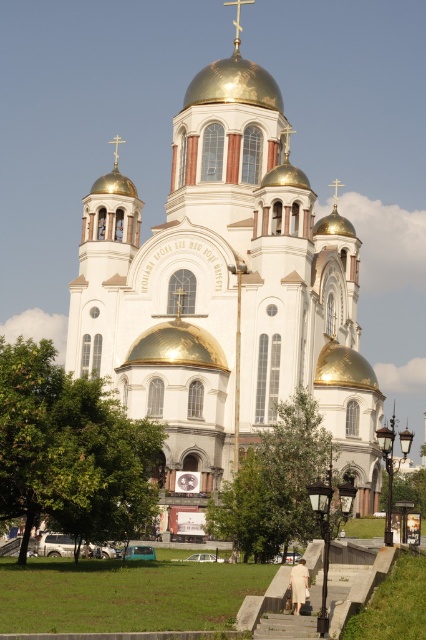
Between point (262, 244) and point (313, 378), which one is positioned in front?

Point (262, 244) is in front.

Describe the element at coordinates (221, 304) in the screenshot. The height and width of the screenshot is (640, 426). I see `white polished stone church at center` at that location.

Describe the element at coordinates (221, 304) in the screenshot. The height and width of the screenshot is (640, 426). I see `white polished stone church at center` at that location.

The height and width of the screenshot is (640, 426). Find the location of `white polished stone church at center`. white polished stone church at center is located at coordinates (221, 304).

Between point (252, 138) and point (229, 100), which one is positioned in front?

Point (229, 100) is more forward.

Is point (238, 221) closer to camera compared to point (199, 88)?

Yes, it is in front of point (199, 88).

Who is more distant from viewer, (x=152, y=352) or (x=247, y=65)?

Positioned behind is point (x=247, y=65).

In order to click on white polished stone church at center in this screenshot , I will do `click(221, 304)`.

Which is in front, point (236, 52) or point (321, 349)?

Positioned in front is point (321, 349).

Can you confirm if gold polished dome at center is thinner than gold metallic dome at center?

In fact, gold polished dome at center might be wider than gold metallic dome at center.

Where is `gold polished dome at center`? The image size is (426, 640). gold polished dome at center is located at coordinates (233, 84).